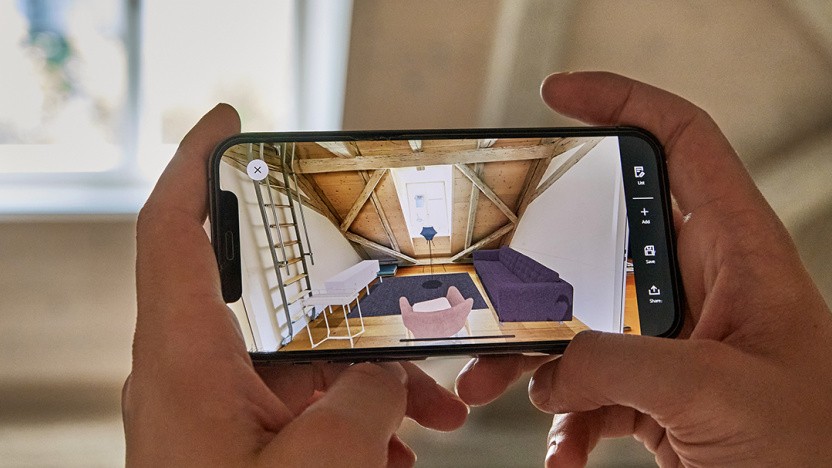
Identify the location of picture of purple sofa on cell phone. The image size is (832, 468). (522, 289).